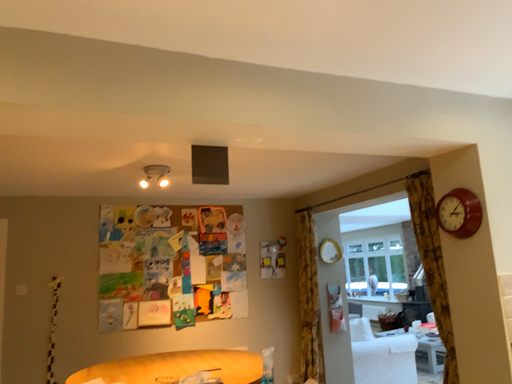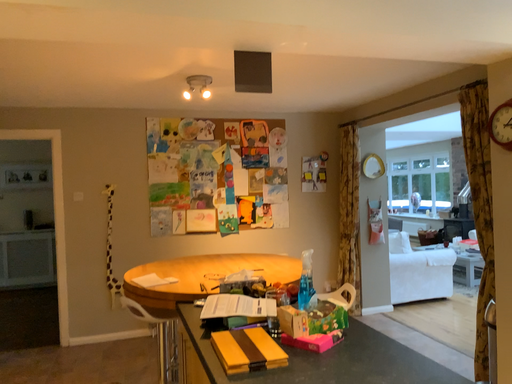
Question: Which way did the camera rotate in the video?

Choices:
 (A) rotated upward
 (B) rotated downward

Answer: (B)